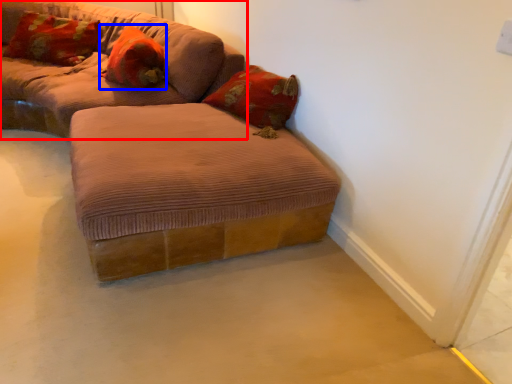
Question: Among these objects, which one is farthest to the camera, studio couch (highlighted by a red box) or pillow (highlighted by a blue box)?

Choices:
 (A) studio couch
 (B) pillow

Answer: (B)